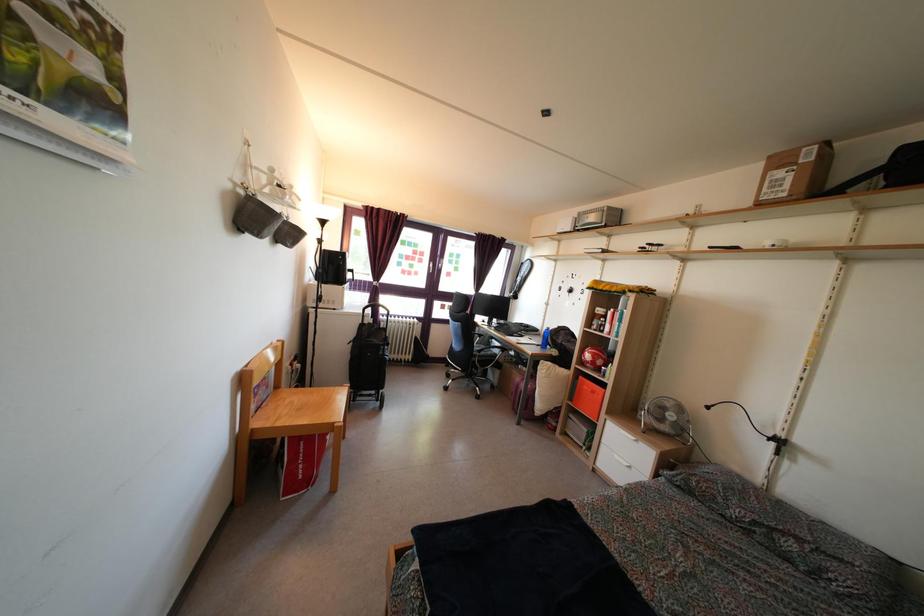
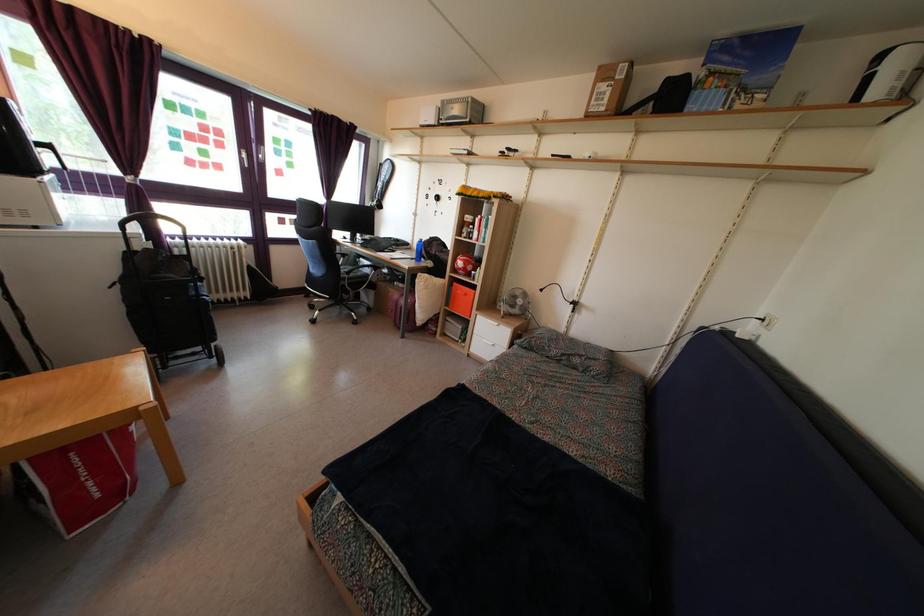
Find the pixel in the second image that matches (x=310, y=490) in the first image.

(122, 501)